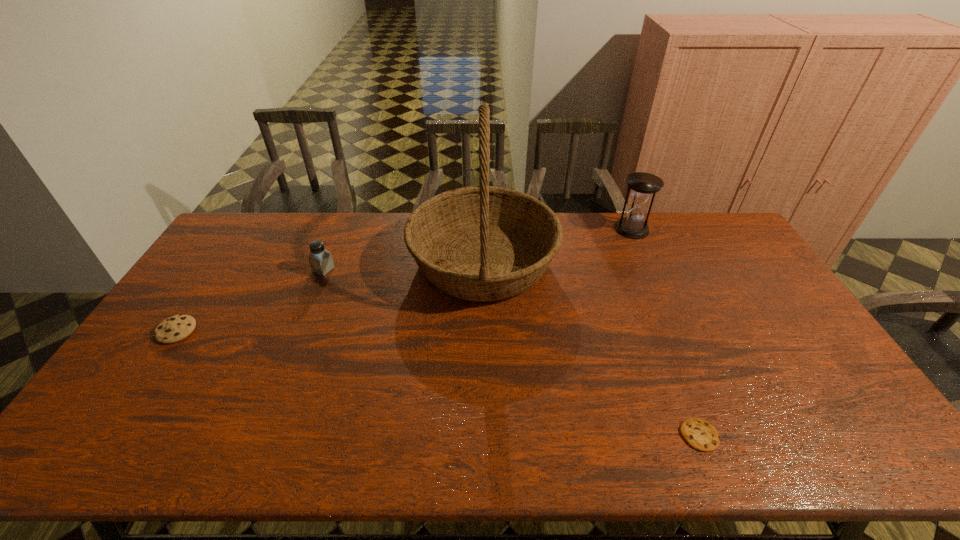
What are the coordinates of `vacant space situated 0.110m on the left of the hourglass` in the screenshot? It's located at (586, 229).

What are the coordinates of `vacant region located 0.130m on the back of the fourth object from right to left` in the screenshot? It's located at (336, 240).

What are the coordinates of `vacant space situated 0.170m on the right of the farther cookie` in the screenshot? It's located at (253, 331).

Locate an element on the screen. The image size is (960, 540). vacant space situated on the left of the shorter cookie is located at coordinates (520, 435).

This screenshot has width=960, height=540. What are the coordinates of `basket present at the far edge` in the screenshot? It's located at (482, 243).

Image resolution: width=960 pixels, height=540 pixels. Identify the location of hourglass that is at the far edge. (644, 186).

The width and height of the screenshot is (960, 540). Find the location of `object that is positioned at the near edge`. object that is positioned at the near edge is located at coordinates (700, 434).

Image resolution: width=960 pixels, height=540 pixels. What are the coordinates of `object that is at the left edge` in the screenshot? It's located at (176, 328).

Identify the location of vacant space at the far edge of the desktop. (389, 218).

Identify the location of vacant space at the left edge of the desktop. This screenshot has width=960, height=540. (228, 268).